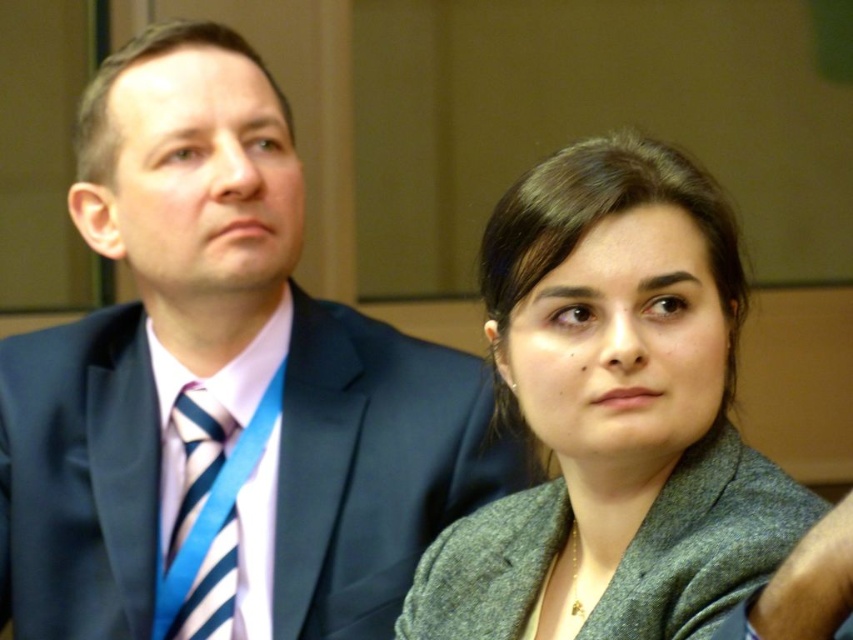
You are an event organizer checking attendee attire for a formal event. You notice the dark blue suit at left and the striped fabric tie at left. Which one is taller?

The dark blue suit at left is much taller than the striped fabric tie at left.

You are organizing a charity event and need to arrange seating based on clothing sizes. If you have a chair that can accommodate up to the size of the gray woolen jacket at center, will the dark blue suit at left fit comfortably?

→ The dark blue suit at left is bigger than the gray woolen jacket at center, so the chair designed for the gray woolen jacket at center may not be large enough to accommodate the dark blue suit at left comfortably.